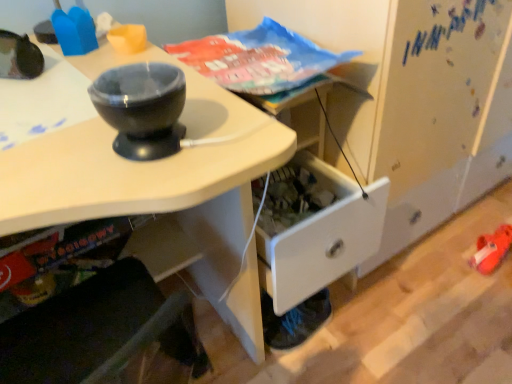
Locate an element on the screen. This screenshot has width=512, height=384. free spot to the right of blue fabric shoe at lower right is located at coordinates (359, 329).